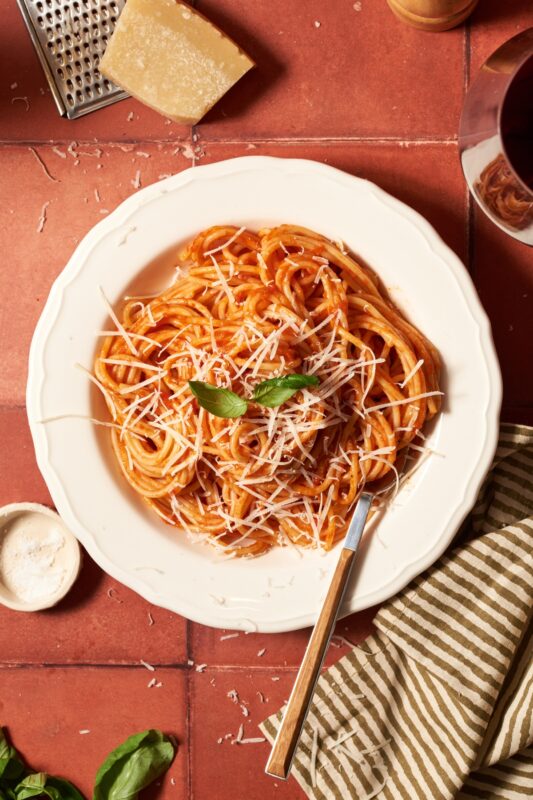
Identify the location of metal cheese grater. The image size is (533, 800). (62, 30).